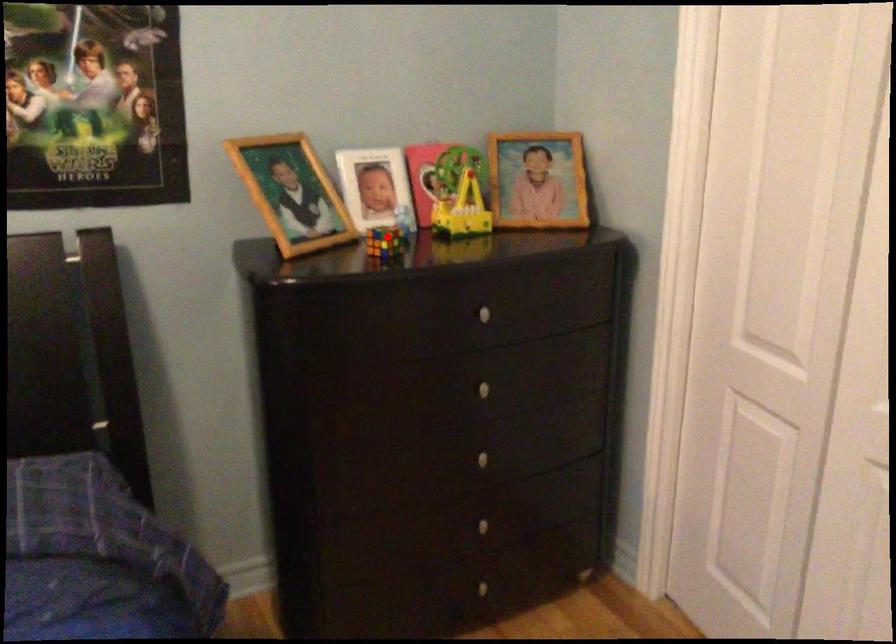
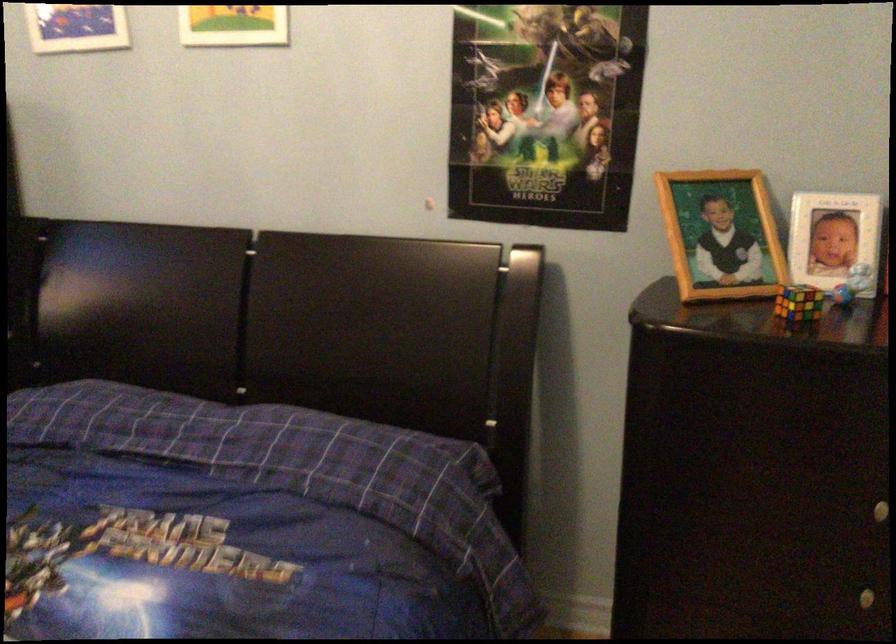
Find the pixel in the second image that matches the highlighted location in the first image.

(798, 303)